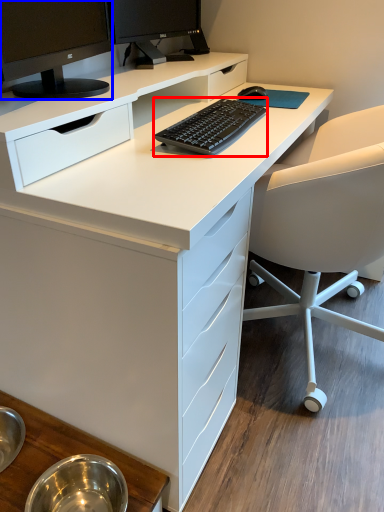
Question: Which object appears farthest to the camera in this image, computer keyboard (highlighted by a red box) or computer monitor (highlighted by a blue box)?

Choices:
 (A) computer keyboard
 (B) computer monitor

Answer: (A)